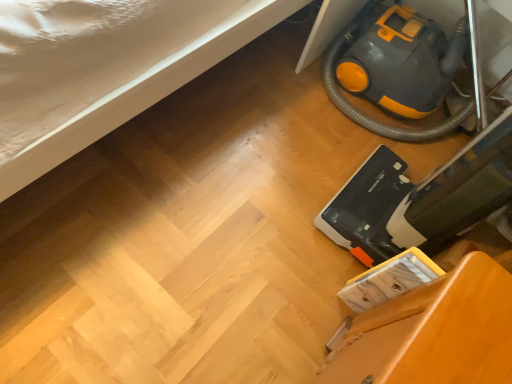
At what (x,y) coordinates should I click in order to perform the action: click on empty space that is in between yellow-orange plastic vacuum cleaner at lower right, the first equipment viewed from the front, and yellow-orange plastic vacuum cleaner at lower right, which is counted as the second equipment, starting from the front. Please return your answer as a coordinate pair (x, y). Image resolution: width=512 pixels, height=384 pixels. Looking at the image, I should click on (322, 154).